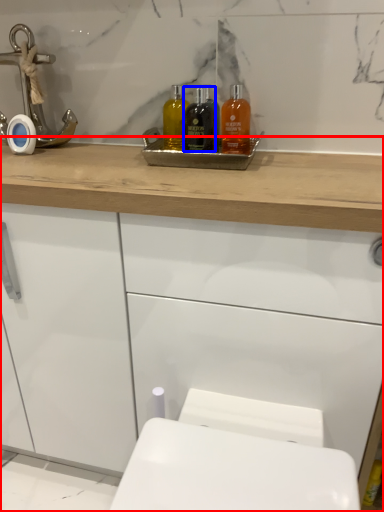
Question: Which of the following is the farthest to the observer, bathroom cabinet (highlighted by a red box) or mouthwash (highlighted by a blue box)?

Choices:
 (A) bathroom cabinet
 (B) mouthwash

Answer: (B)